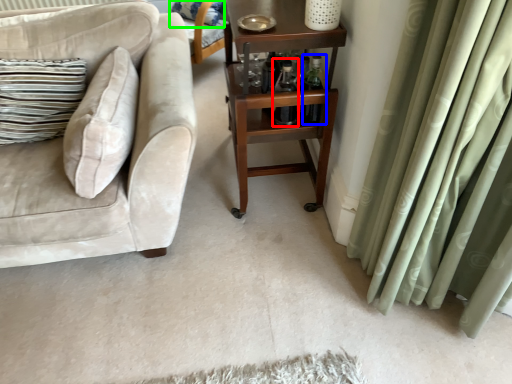
Question: Which object is the closest to the bottle (highlighted by a red box)? Choose among these: bottle (highlighted by a blue box) or pillow (highlighted by a green box).

Choices:
 (A) bottle
 (B) pillow

Answer: (A)